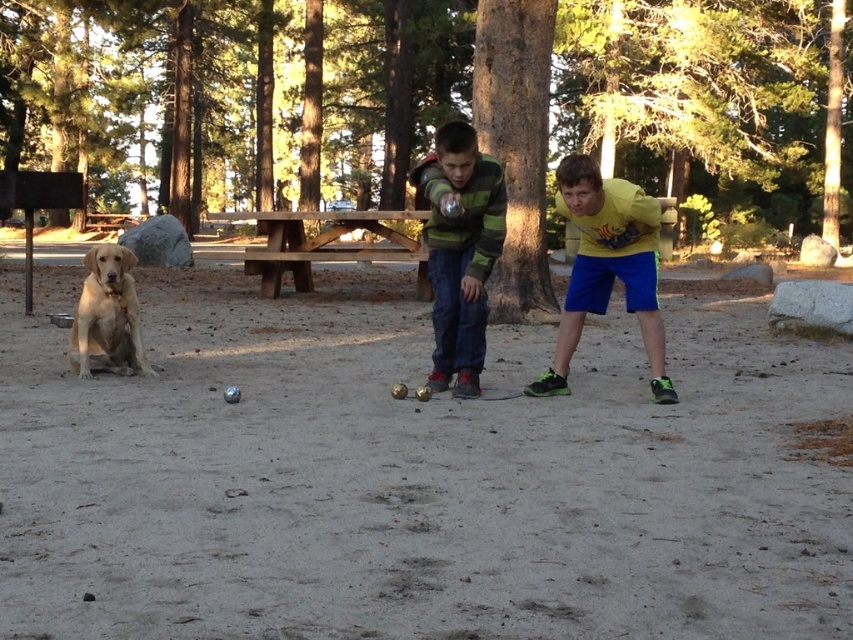
Question: Does brown sandy ground at center lie in front of yellow matte shirt at center?

Choices:
 (A) yes
 (B) no

Answer: (A)

Question: Is brown sandy ground at center to the left of green striped sweater at center from the viewer's perspective?

Choices:
 (A) yes
 (B) no

Answer: (A)

Question: Which of the following is the closest to the observer?

Choices:
 (A) (590, 236)
 (B) (440, 301)
 (C) (86, 346)

Answer: (A)

Question: Which object is the farthest from the yellow matte shirt at center?

Choices:
 (A) brown sandy ground at center
 (B) golden fur dog at left
 (C) brown wooden picnic table at center

Answer: (C)

Question: Can you confirm if brown sandy ground at center is wider than yellow matte shirt at center?

Choices:
 (A) yes
 (B) no

Answer: (A)

Question: Which point is closer to the camera?

Choices:
 (A) yellow matte shirt at center
 (B) green striped sweater at center

Answer: (A)